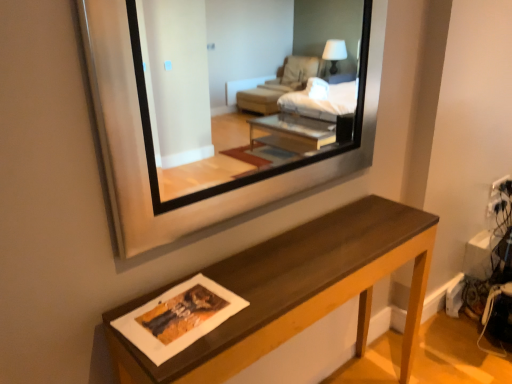
In order to face white plastic electric outlet at right, should I rotate leftwards or rightwards?

To face it directly, rotate right by 29.819 degrees.

This screenshot has width=512, height=384. What do you see at coordinates (502, 186) in the screenshot? I see `white plastic electric outlet at right` at bounding box center [502, 186].

The width and height of the screenshot is (512, 384). Find the location of `white plastic electric outlet at right`. white plastic electric outlet at right is located at coordinates (502, 186).

Find the location of `white plastic electric outlet at right`. white plastic electric outlet at right is located at coordinates (502, 186).